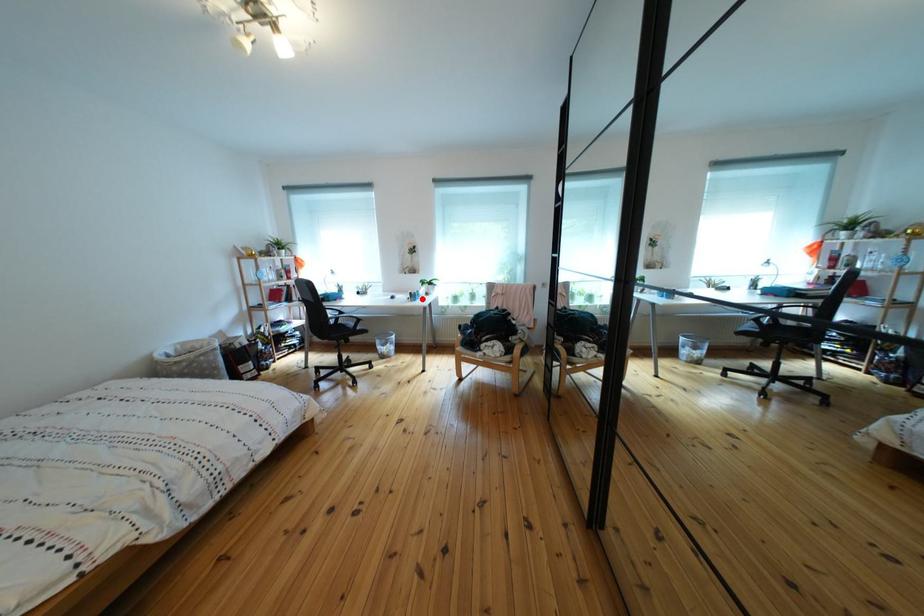
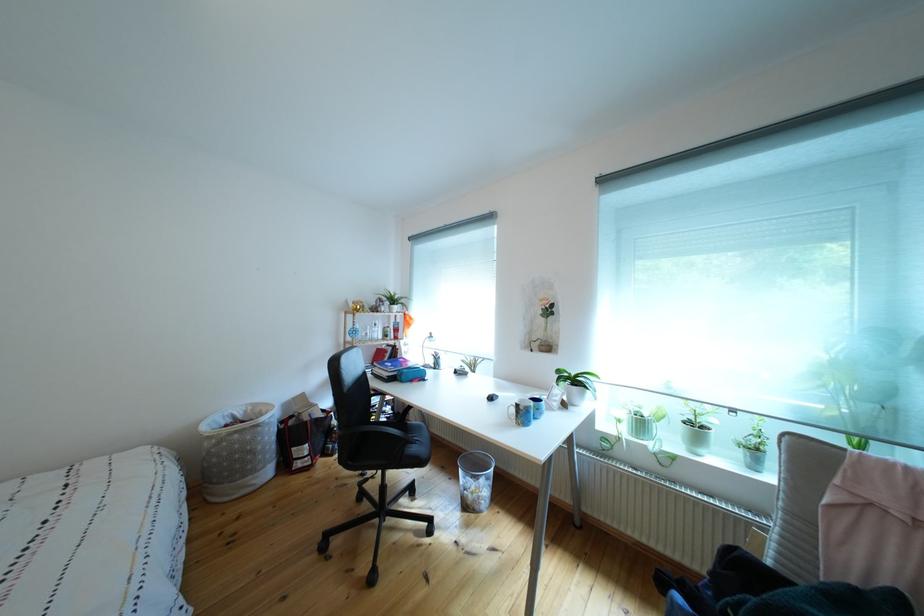
Question: A red point is marked in image1. In image2, is the corresponding 3D point closer to the camera or farther? Reply with the corresponding letter.

Choices:
 (A) The corresponding 3D point is closer.
 (B) The corresponding 3D point is farther.

Answer: (B)